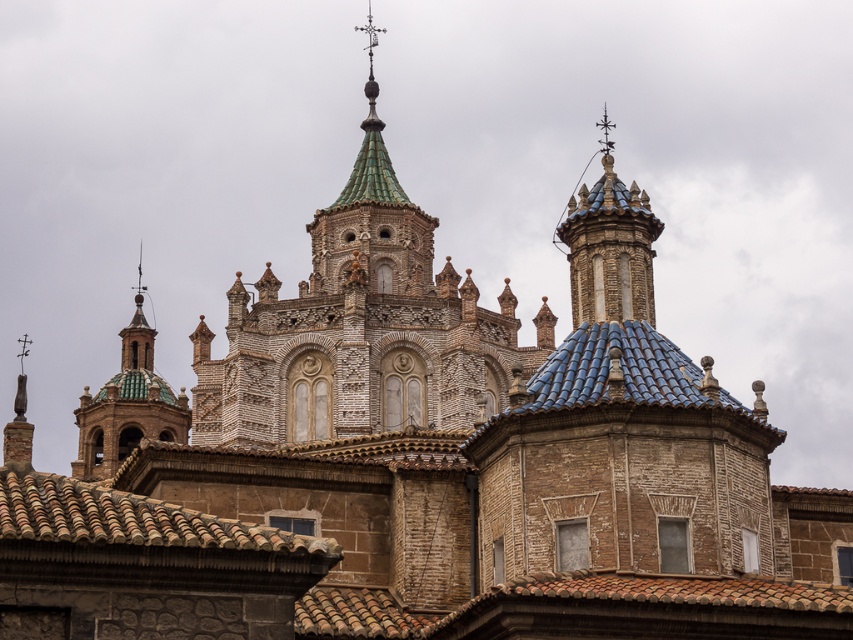
You are standing at the base of the historic building and want to touch the blue glazed tiles at upper center. Given that the average human arm length is 2.3 feet, can you reach them without any assistance?

The blue glazed tiles at upper center are 180.33 feet from the viewer, which is far beyond the average human arm length of 2.3 feet. Therefore, you cannot reach them without assistance.

You are an architect examining the historic building. You need to determine which of the two elements, the blue glazed tiles at upper center or the green glazed tile dome at upper left, is wider. Based on the image, which one is wider?

The green glazed tile dome at upper left is wider than the blue glazed tiles at upper center.

In the scene shown: Looking at the historic building, which object is positioned to the right of the other between the green glazed tile tower at center and the green glazed tile dome at upper left?

The green glazed tile tower at center is positioned to the right of the green glazed tile dome at upper left.